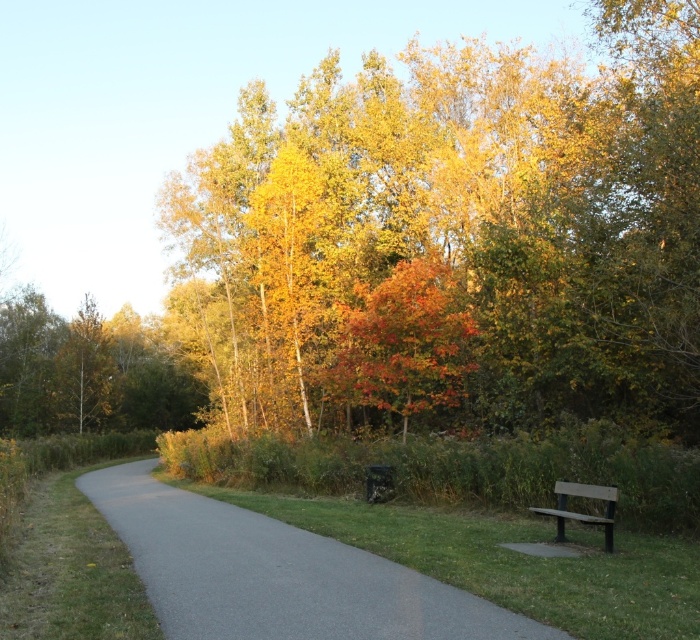
Question: Is gray asphalt path at center bigger than brown wooden bench at lower right?

Choices:
 (A) no
 (B) yes

Answer: (B)

Question: Does golden yellow leaves at upper center appear under shiny orange leaves at center?

Choices:
 (A) no
 (B) yes

Answer: (A)

Question: Is golden yellow leaves at upper center closer to camera compared to brown wooden bench at lower right?

Choices:
 (A) yes
 (B) no

Answer: (B)

Question: Which of these objects is positioned closest to the brown wooden bench at lower right?

Choices:
 (A) golden yellow leaves at upper center
 (B) shiny orange leaves at center
 (C) gray asphalt path at center

Answer: (C)

Question: Considering the real-world distances, which object is closest to the gray asphalt path at center?

Choices:
 (A) golden yellow leaves at upper center
 (B) shiny orange leaves at center
 (C) brown wooden bench at lower right

Answer: (C)

Question: Which object is the farthest from the golden yellow leaves at upper center?

Choices:
 (A) shiny orange leaves at center
 (B) gray asphalt path at center

Answer: (B)